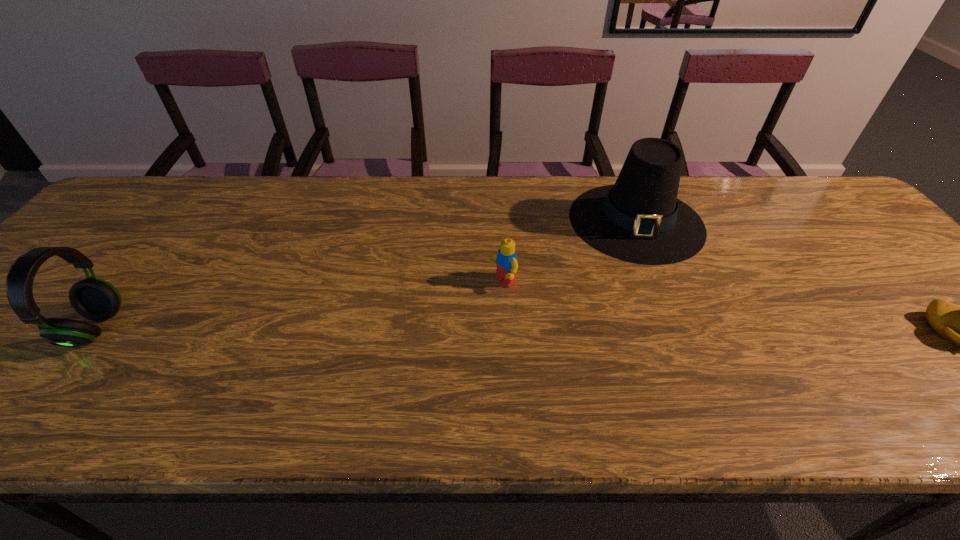
I want to click on vacant space on the desktop that is between the leftmost object and the duckling and is positioned on the front-facing side of the hat, so click(x=638, y=330).

Locate an element on the screen. The width and height of the screenshot is (960, 540). free spot on the desktop that is between the headset and the shortest object and is positioned on the front-facing side of the Lego is located at coordinates (423, 329).